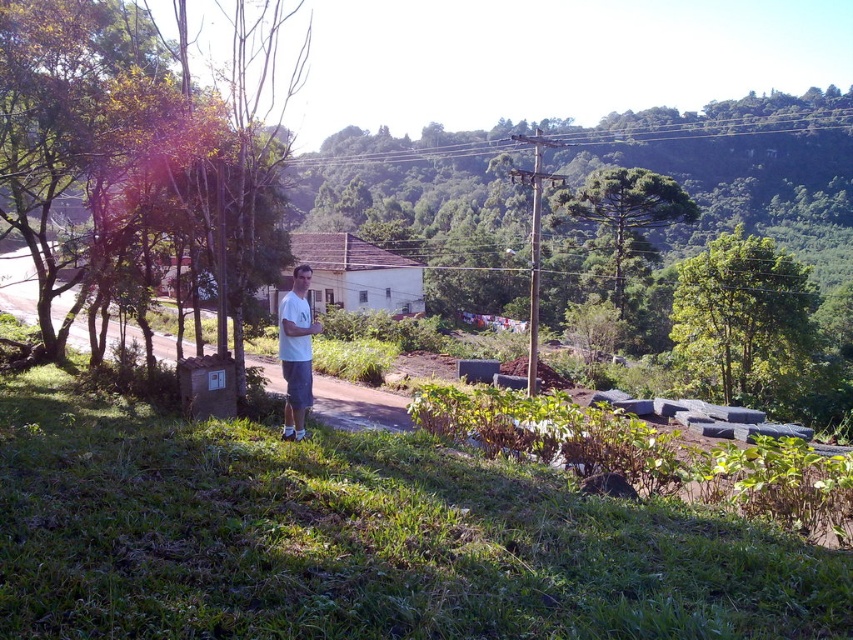
You are a hiker who wants to take a photo of the white matte shirt at center and the green leafy tree at upper right. Which object should you focus on first if you want to capture both in a single shot without moving the camera?

You should focus on the green leafy tree at upper right first because it is taller than the white matte shirt at center, allowing you to adjust the camera settings for depth of field to include both objects in the frame.

You are standing at point (x=724, y=384) and want to walk to point (x=694, y=205). Based on the scene description, will you have to walk towards the house or away from it?

Since point (x=724, y=384) is in front of point (x=694, y=205) and the house is in the midground, walking from point (x=724, y=384) to point (x=694, y=205) means moving away from the house.

You are standing at the man in the image. Which direction should you look to see the green leafy tree at upper right?

The green leafy tree at upper right is located at point (741, 321), so you should look to the upper right direction from the man to see it.